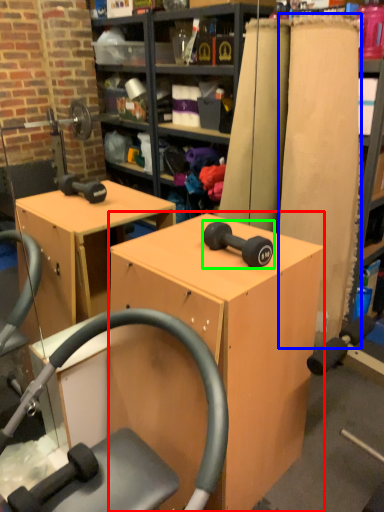
Question: Considering the real-world distances, which object is farthest from furniture (highlighted by a red box)? plank (highlighted by a blue box) or dumbbell (highlighted by a green box)?

Choices:
 (A) plank
 (B) dumbbell

Answer: (A)